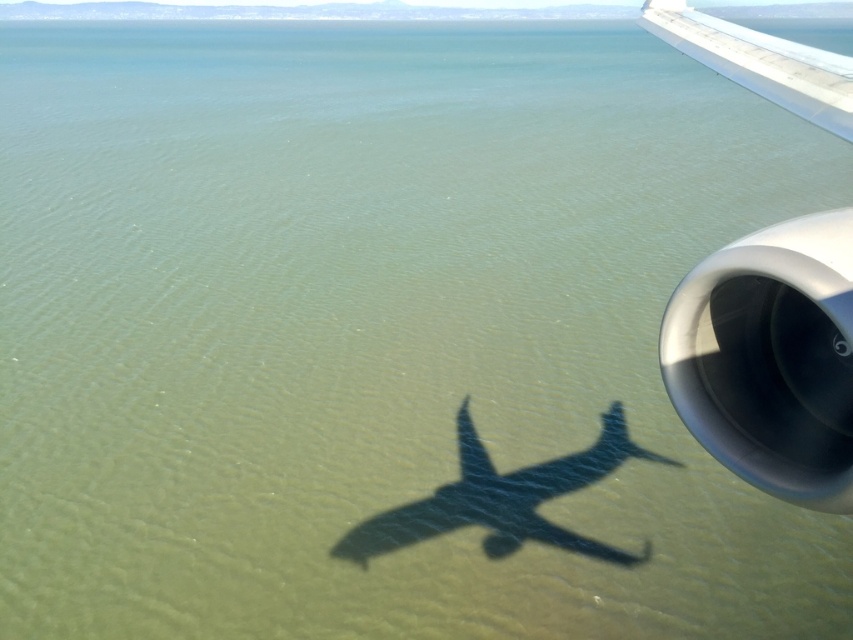
Question: Does silver metallic engine at right appear on the left side of white metallic wing at upper right?

Choices:
 (A) no
 (B) yes

Answer: (B)

Question: Can you confirm if silver metallic engine at right is thinner than white metallic wing at upper right?

Choices:
 (A) no
 (B) yes

Answer: (B)

Question: Can you confirm if silver metallic engine at right is positioned to the right of white metallic wing at upper right?

Choices:
 (A) no
 (B) yes

Answer: (A)

Question: Among these objects, which one is nearest to the camera?

Choices:
 (A) silver metallic engine at right
 (B) white metallic wing at upper right

Answer: (A)

Question: Among these points, which one is farthest from the camera?

Choices:
 (A) click(x=726, y=58)
 (B) click(x=751, y=44)

Answer: (B)